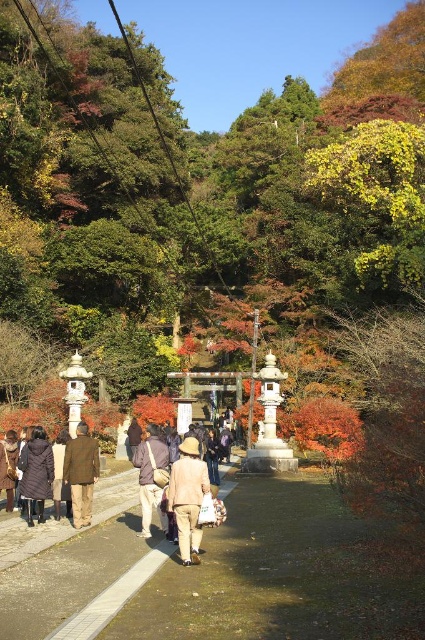
Question: Does beige fabric hat at center appear over brown leather jacket at center?

Choices:
 (A) no
 (B) yes

Answer: (B)

Question: Is smooth concrete pavement at center smaller than dark brown leather jacket at lower left?

Choices:
 (A) yes
 (B) no

Answer: (B)

Question: Which point is farther to the camera?

Choices:
 (A) brown woolen coat at center
 (B) dark brown down jacket at lower left

Answer: (B)

Question: Which is farther from the brown leather jacket at center?

Choices:
 (A) brown woolen coat at center
 (B) dark brown down jacket at lower left

Answer: (B)

Question: Can you confirm if beige fabric hat at center is thinner than dark brown down jacket at lower left?

Choices:
 (A) no
 (B) yes

Answer: (B)

Question: Which object appears farthest from the camera in this image?

Choices:
 (A) beige fabric hat at center
 (B) dark brown down jacket at lower left
 (C) brown woolen coat at center
 (D) dark brown leather jacket at lower left

Answer: (D)